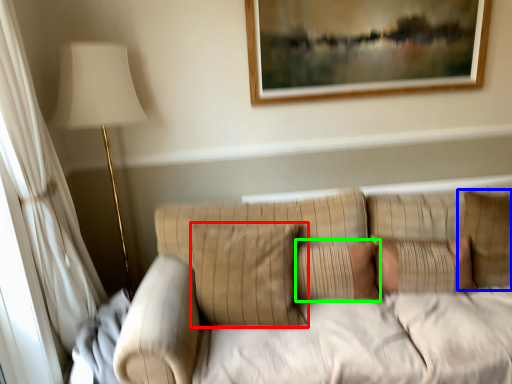
Question: Which object is the farthest from pillow (highlighted by a red box)? Choose among these: pillow (highlighted by a blue box) or pillow (highlighted by a green box).

Choices:
 (A) pillow
 (B) pillow

Answer: (A)